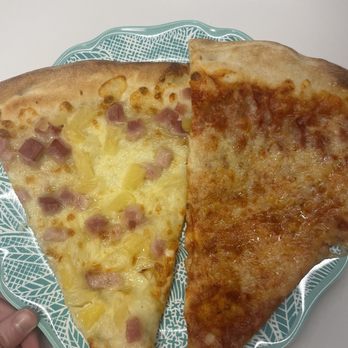
In order to click on bottom right corner of table in this screenshot , I will do `click(338, 326)`.